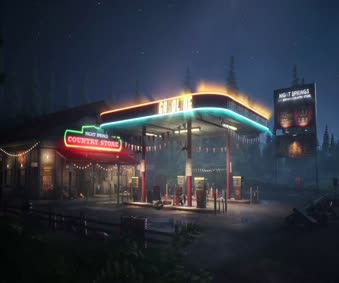
You are a GUI agent. You are given a task and a screenshot of the screen. Output one action in this format:
    pyautogui.click(x=<x>, y=<y>)
    Task: Click on the red support pillars
    The height and width of the screenshot is (283, 339).
    Given the screenshot: What is the action you would take?
    pyautogui.click(x=190, y=154), pyautogui.click(x=143, y=150), pyautogui.click(x=229, y=150)